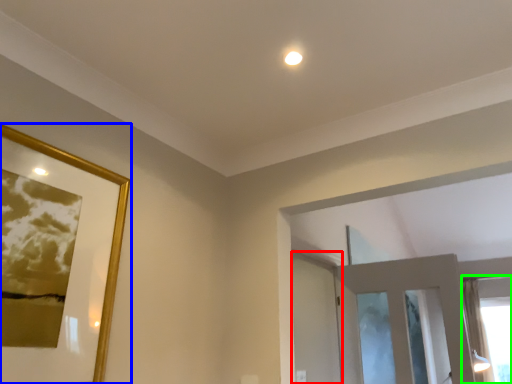
Question: Which object is the closest to the screen door (highlighted by a red box)? Choose among these: picture frame (highlighted by a blue box) or window (highlighted by a green box).

Choices:
 (A) picture frame
 (B) window

Answer: (A)